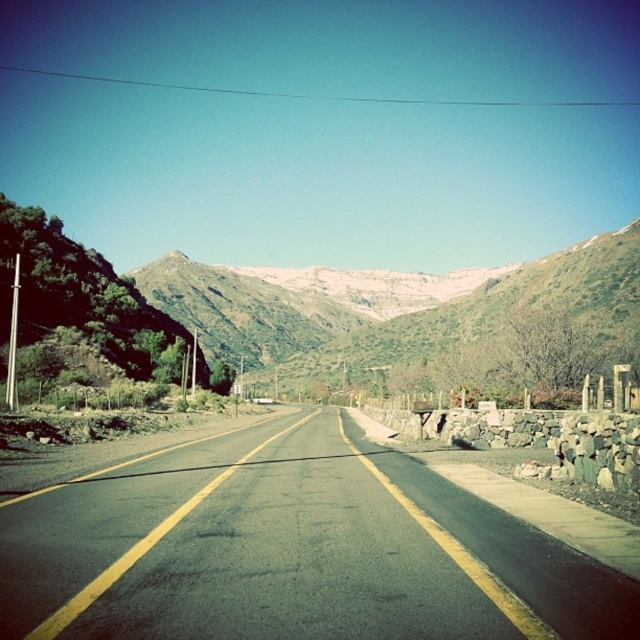
You are driving a car and see the asphalt road at center and the smooth stone wall at right. Which one is higher in elevation?

The asphalt road at center is positioned over smooth stone wall at right, so the asphalt road at center is higher in elevation than the smooth stone wall at right.

You are a driver approaching the two lane road at center. You need to determine if you can safely pass another vehicle ahead of you. Based on the scene description and the position of the asphalt road at center at point (294, 548), can you confirm if the road is wide enough for passing?

The asphalt road at center is located at point (294, 548), but there is a double yellow line indicating no passing zones. Therefore, the road is not wide enough to safely pass another vehicle ahead.